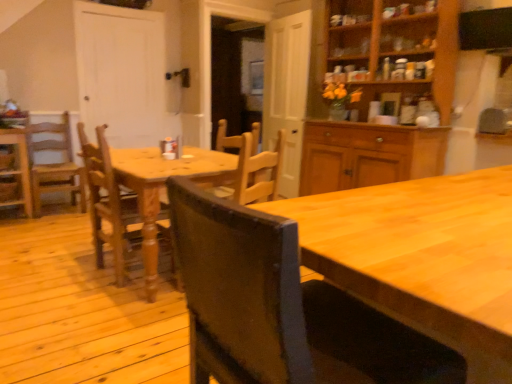
The width and height of the screenshot is (512, 384). Find the location of `free space in front of wooden chair at center, which appears as the second chair when viewed from the front`. free space in front of wooden chair at center, which appears as the second chair when viewed from the front is located at coordinates (98, 299).